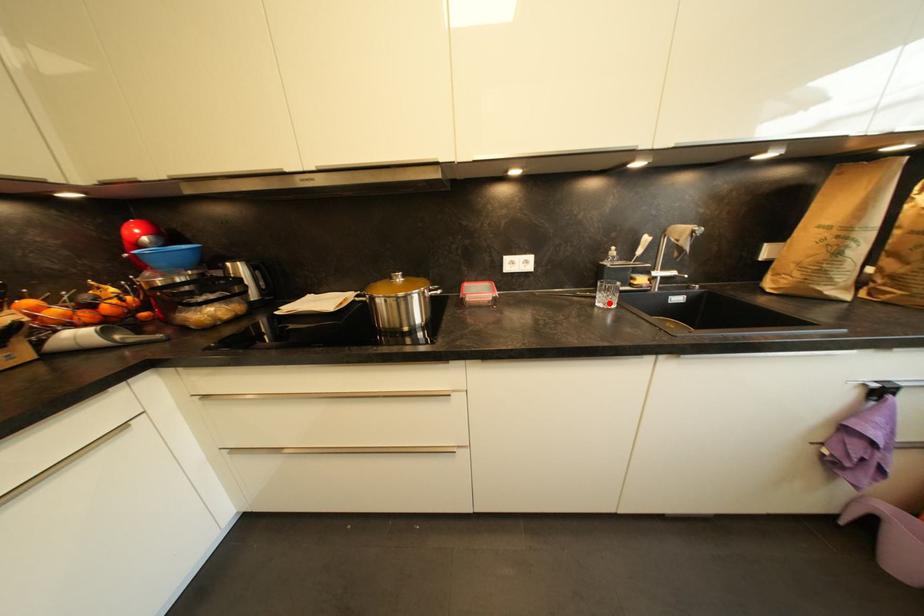
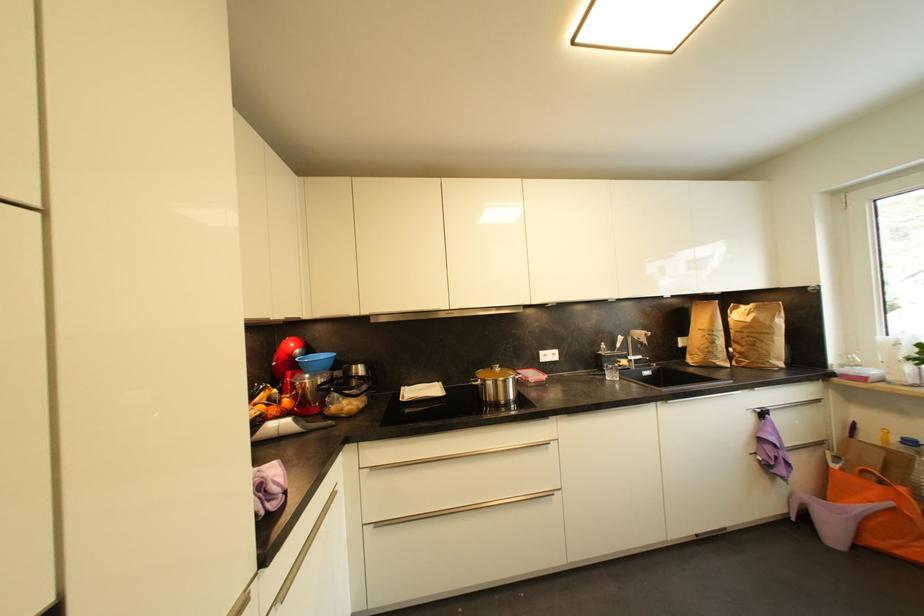
Find the pixel in the second image that matches the highlighted location in the first image.

(616, 378)